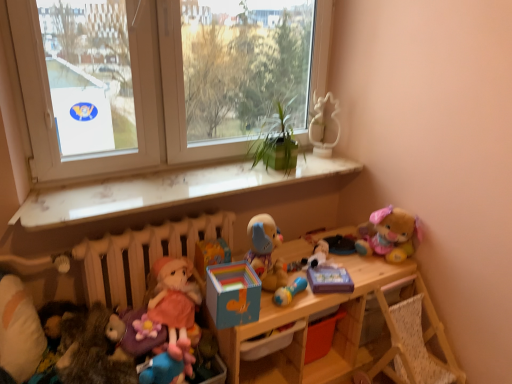
The image size is (512, 384). What are the coordinates of `space that is in front of fluffy plush bear at upper right, placed as the 7th toy when sorted from left to right` in the screenshot? It's located at (374, 272).